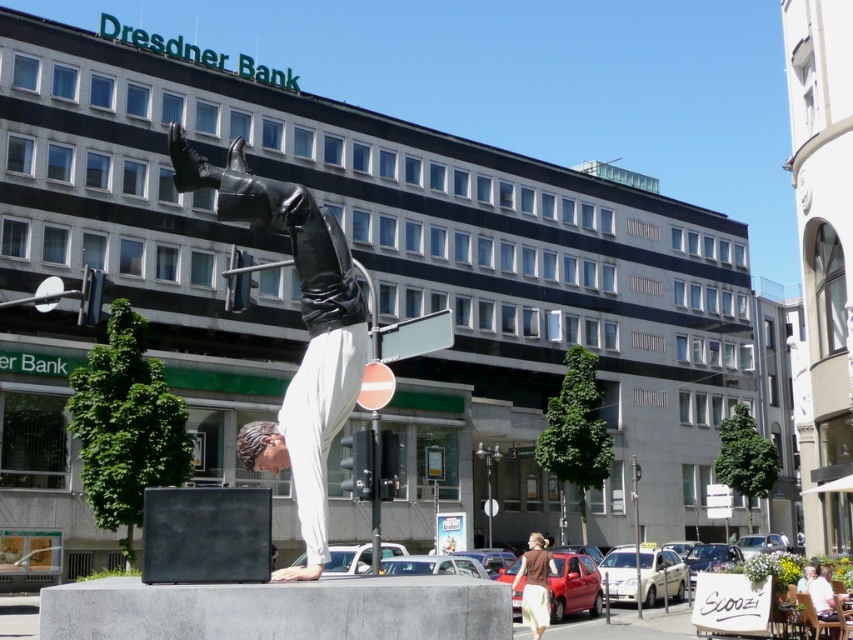
You are a photographer standing in the park where the polished bronze statue at center and the brown cotton shirt at lower center are located. You want to take a photo that includes both objects without any obstructions. Based on their positions, which object should you focus on first to ensure both are in frame?

The polished bronze statue at center is positioned over the brown cotton shirt at lower center. To include both in the frame without obstruction, focus on the statue first as it is above the shirt, allowing the shirt to be visible below.

You are standing in front of the sculpture and want to take a photo of the point at coordinates point (334,333). If your camera can focus on objects up to 8 meters away, will it be able to capture that point clearly?

The distance of point (334,333) from the viewer is 7.28 meters, which is within the camera focus range of up to 8 meters. Therefore, the camera can capture the point clearly.

You are standing in a public square and see the polished bronze statue at center. If you want to take a photo of it from a distance where it fills the frame without being too close, would 22.22 feet be a suitable distance?

The polished bronze statue at center is 22.22 feet from viewer, so standing at that distance would allow the statue to fill the frame appropriately without being too close.